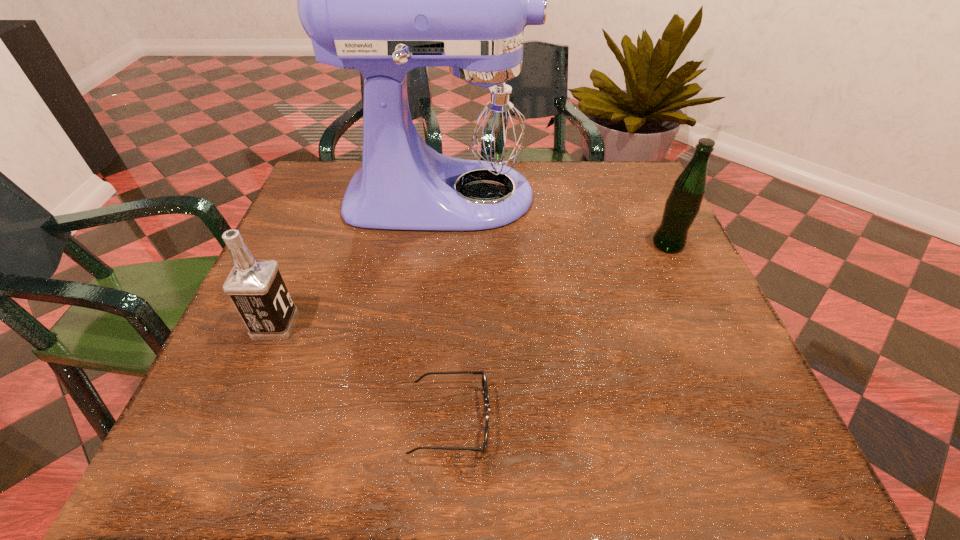
The height and width of the screenshot is (540, 960). In order to click on free space at the far left corner of the desktop in this screenshot , I will do `click(350, 163)`.

Locate an element on the screen. free location at the near left corner of the desktop is located at coordinates (211, 418).

You are a GUI agent. You are given a task and a screenshot of the screen. Output one action in this format:
    pyautogui.click(x=<x>, y=<y>)
    Task: Click on the free region at the far right corner of the desktop
    The height and width of the screenshot is (540, 960).
    Given the screenshot: What is the action you would take?
    coord(635,178)

I want to click on free point between the spectacles and the vodka, so click(363, 373).

I want to click on vacant area between the tallest object and the shortest object, so click(448, 308).

Find the location of a particular element. The width and height of the screenshot is (960, 540). empty space between the spectacles and the beer bottle is located at coordinates (560, 332).

This screenshot has width=960, height=540. Find the location of `free point between the shortest object and the mixer`. free point between the shortest object and the mixer is located at coordinates (448, 308).

What are the coordinates of `free space between the tallest object and the beer bottle` in the screenshot? It's located at (558, 220).

Find the location of a particular element. free spot between the shortest object and the mixer is located at coordinates (448, 308).

Where is `blank region between the shortest object and the rightmost object`? The width and height of the screenshot is (960, 540). blank region between the shortest object and the rightmost object is located at coordinates (560, 332).